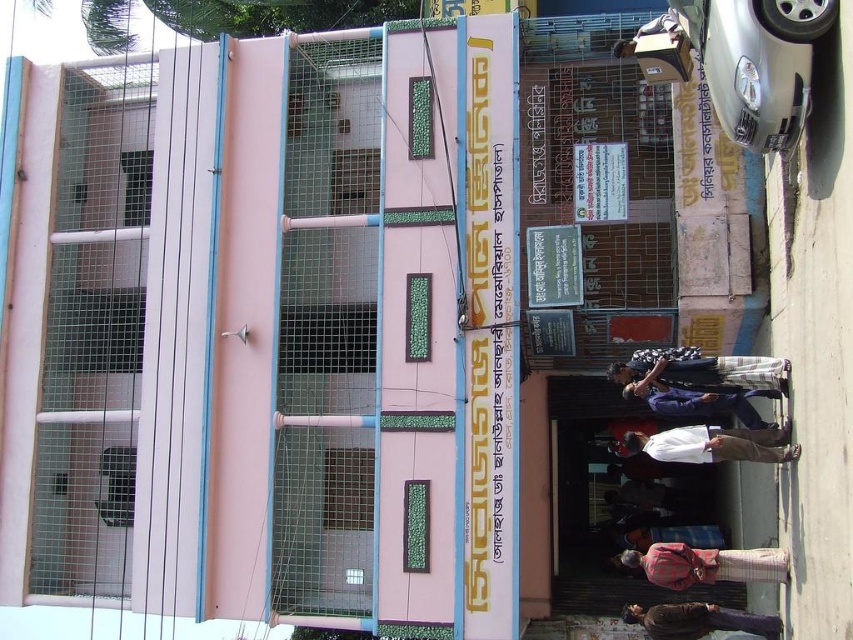
Question: Which object is closer to the camera taking this photo?

Choices:
 (A) white cotton shirt at center
 (B) brown leather jacket at lower center

Answer: (A)

Question: Is silver metallic car at right thinner than red plaid shirt at lower center?

Choices:
 (A) yes
 (B) no

Answer: (A)

Question: Is red plaid shirt at lower center thinner than dark blue shirt at center?

Choices:
 (A) no
 (B) yes

Answer: (B)

Question: Which object is closer to the camera taking this photo?

Choices:
 (A) white cotton shirt at center
 (B) red plaid shirt at lower center
 (C) silver metallic car at right
 (D) brown leather jacket at lower center

Answer: (C)

Question: Does white cotton shirt at center appear under dark blue shirt at center?

Choices:
 (A) no
 (B) yes

Answer: (B)

Question: Which of the following is the closest to the observer?

Choices:
 (A) brown leather jacket at lower center
 (B) red plaid shirt at lower center

Answer: (B)